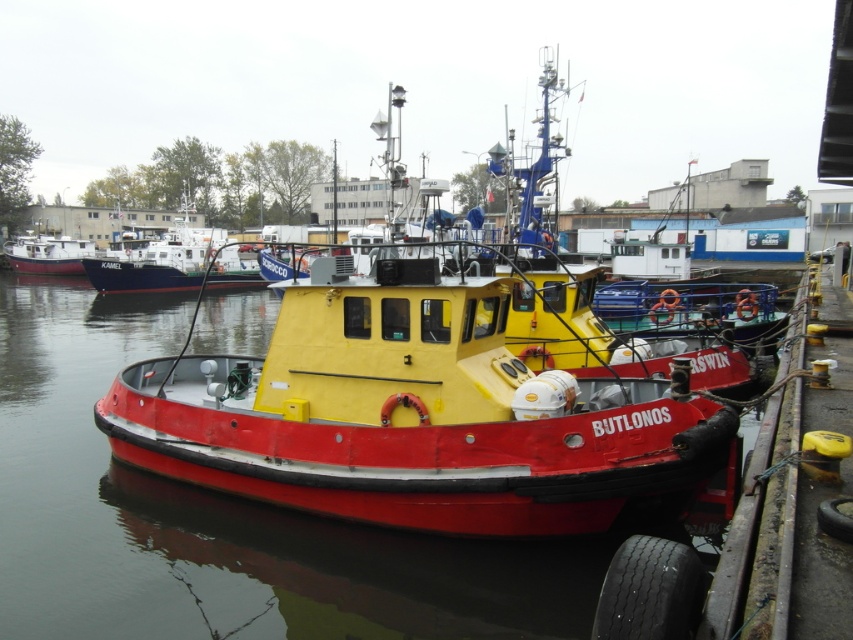
Between red matte tugboat at center and red matte boat at left, which one is positioned lower?

red matte tugboat at center

Between red matte tugboat at center and red matte boat at left, which one appears on the right side from the viewer's perspective?

red matte tugboat at center

Who is more forward, (337, 372) or (10, 262)?

Point (337, 372) is more forward.

Find the location of a particular element. The image size is (853, 640). red matte tugboat at center is located at coordinates (424, 406).

Which is more to the right, red matte tugboat at center or matte white boat at upper left?

red matte tugboat at center is more to the right.

Does red matte tugboat at center appear on the left side of matte white boat at upper left?

In fact, red matte tugboat at center is to the right of matte white boat at upper left.

Is point (436, 336) closer to viewer compared to point (215, 260)?

Yes.

Locate an element on the screen. red matte tugboat at center is located at coordinates (424, 406).

Locate an element on the screen. matte white boat at upper left is located at coordinates (177, 264).

Is matte white boat at upper left thinner than red matte boat at left?

Yes, matte white boat at upper left is thinner than red matte boat at left.

Measure the distance between point (x=219, y=246) and camera.

Point (x=219, y=246) is 47.91 meters from camera.

The height and width of the screenshot is (640, 853). In order to click on matte white boat at upper left in this screenshot , I will do `click(177, 264)`.